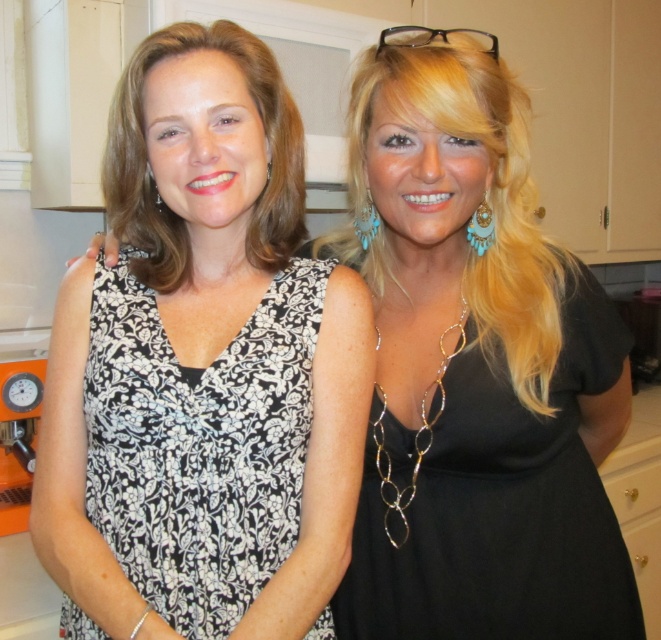
You are a fashion designer who needs to place a new accessory on the black matte dress at right. According to the coordinate system where the bottom left corner is the origin, where should you place the accessory?

The black matte dress at right is positioned at coordinate point (502, 502), so the accessory should be placed at that location.

You are organizing a fashion show and need to arrange two dresses in a display window. The display window has a left and right side. The black floral fabric dress at center is already placed on the left side. Where should the black matte dress at right be placed to match the original image?

The black matte dress at right should be placed on the right side of the display window to match its position in the original image, as it was positioned on the right side of the black floral fabric dress at center.